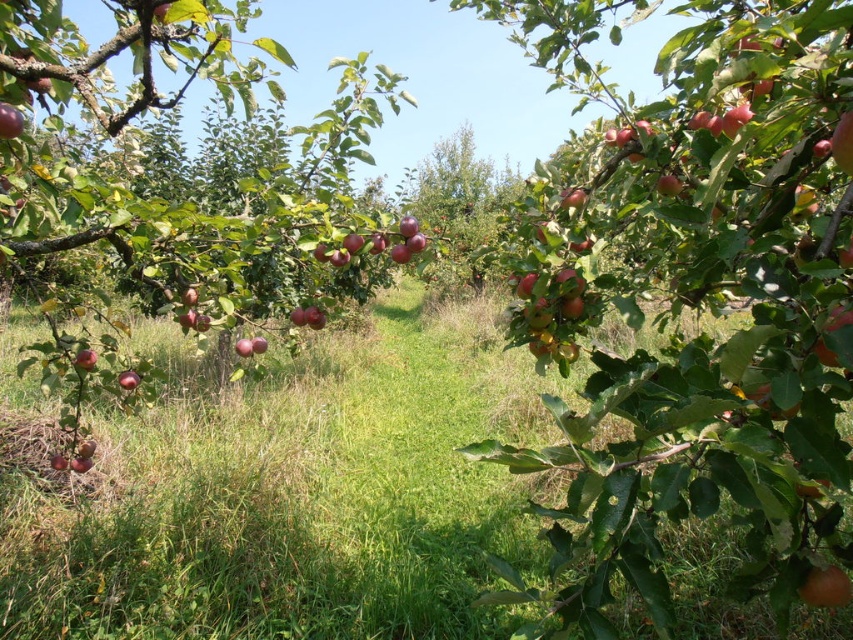
Question: Which object appears closest to the camera in this image?

Choices:
 (A) green grass at center
 (B) shiny red apple at lower left

Answer: (A)

Question: Among these points, which one is nearest to the camera?

Choices:
 (A) (125, 381)
 (B) (247, 589)

Answer: (A)

Question: Is the position of shiny red apple at center more distant than that of glossy red apple at center?

Choices:
 (A) yes
 (B) no

Answer: (B)

Question: Which point appears closest to the camera in this image?

Choices:
 (A) (844, 580)
 (B) (136, 372)

Answer: (A)

Question: Is green grass at center thinner than shiny red apple at lower left?

Choices:
 (A) no
 (B) yes

Answer: (A)

Question: Can you confirm if green grass at center is positioned above glossy red apple at center?

Choices:
 (A) yes
 (B) no

Answer: (B)